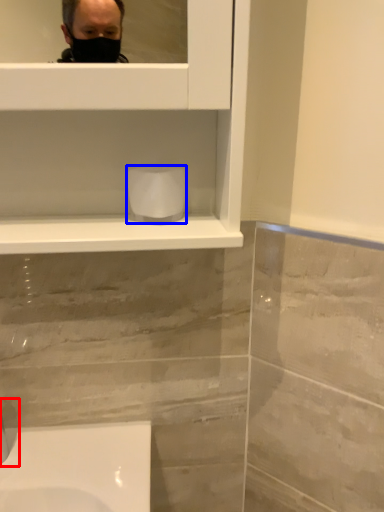
Question: Which object appears closest to the camera in this image, faucet (highlighted by a red box) or toilet paper (highlighted by a blue box)?

Choices:
 (A) faucet
 (B) toilet paper

Answer: (A)